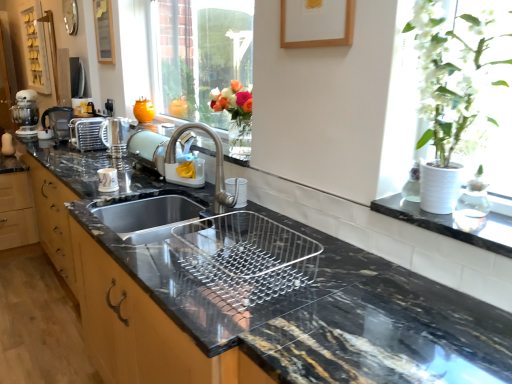
Measure the distance between point (455, 63) and camera.

Point (455, 63) and camera are 1.10 meters apart from each other.

The height and width of the screenshot is (384, 512). Identify the location of wooden picture frame at upper left, placed as the 2th picture frame when sorted from right to left. (104, 31).

This screenshot has width=512, height=384. What do you see at coordinates (115, 301) in the screenshot?
I see `metallic oak cabinet at left` at bounding box center [115, 301].

The width and height of the screenshot is (512, 384). Find the location of `white matte vase at upper right`. white matte vase at upper right is located at coordinates (451, 74).

Is wooden picture frame at upper left, the first picture frame in the left-to-right sequence, smaller than black marble sink at center?

Correct, wooden picture frame at upper left, the first picture frame in the left-to-right sequence, occupies less space than black marble sink at center.

Considering the sizes of wooden picture frame at upper left, which ranks as the first picture frame in top-to-bottom order, and black marble sink at center in the image, is wooden picture frame at upper left, which ranks as the first picture frame in top-to-bottom order, wider or thinner than black marble sink at center?

In the image, wooden picture frame at upper left, which ranks as the first picture frame in top-to-bottom order, appears to be more narrow than black marble sink at center.

Does wooden picture frame at upper left, which ranks as the first picture frame in top-to-bottom order, turn towards black marble sink at center?

No, wooden picture frame at upper left, which ranks as the first picture frame in top-to-bottom order, is not oriented towards black marble sink at center.

Is white matte vase at upper right far away from metallic silver toaster at upper left, which is counted as the second appliance, starting from the right?

Yes, white matte vase at upper right and metallic silver toaster at upper left, which is counted as the second appliance, starting from the right, are quite far apart.

Looking at the image, does white matte vase at upper right seem bigger or smaller compared to metallic silver toaster at upper left, which is counted as the second appliance, starting from the right?

white matte vase at upper right is bigger than metallic silver toaster at upper left, which is counted as the second appliance, starting from the right.

Considering the sizes of white matte vase at upper right and metallic silver toaster at upper left, which is the second appliance from front to back, in the image, is white matte vase at upper right taller or shorter than metallic silver toaster at upper left, which is the second appliance from front to back,?

white matte vase at upper right is taller than metallic silver toaster at upper left, which is the second appliance from front to back.

Where is `appliance that is the 2nd one below the white matte vase at upper right (from a real-world perspective)`? The width and height of the screenshot is (512, 384). appliance that is the 2nd one below the white matte vase at upper right (from a real-world perspective) is located at coordinates (86, 134).

In the image, there is a metallic silver toaster at upper left, marked as the first appliance in a back-to-front arrangement. Where is `window above it (from the image's perspective)`? The height and width of the screenshot is (384, 512). window above it (from the image's perspective) is located at coordinates (200, 54).

Is clear glass window at center positioned with its back to metallic silver toaster at upper left, which is the second appliance from front to back?

No, clear glass window at center is not facing the opposite direction of metallic silver toaster at upper left, which is the second appliance from front to back.

From the image's perspective, is clear glass window at center on top of metallic silver toaster at upper left, which is counted as the second appliance, starting from the right?

Correct, clear glass window at center appears higher than metallic silver toaster at upper left, which is counted as the second appliance, starting from the right, in the image.

Based on the photo, which of these two, clear glass window at center or metallic silver toaster at upper left, which is counted as the second appliance, starting from the right, stands taller?

With more height is clear glass window at center.

Is the position of wooden picture frame at upper center, placed as the 1th picture frame when sorted from front to back, more distant than that of satin nickel faucet at center?

No, wooden picture frame at upper center, placed as the 1th picture frame when sorted from front to back, is closer to the viewer.

Is wooden picture frame at upper center, the 1th picture frame when ordered from bottom to top, oriented away from satin nickel faucet at center?

No, wooden picture frame at upper center, the 1th picture frame when ordered from bottom to top, is not facing the opposite direction of satin nickel faucet at center.

Considering the positions of objects wooden picture frame at upper center, the second picture frame positioned from the top, and satin nickel faucet at center in the image provided, who is more to the right, wooden picture frame at upper center, the second picture frame positioned from the top, or satin nickel faucet at center?

From the viewer's perspective, wooden picture frame at upper center, the second picture frame positioned from the top, appears more on the right side.

Does wooden picture frame at upper center, the second picture frame from the left, have a greater width compared to metallic silver toaster at upper left, which is the second appliance from front to back?

No.

Is wooden picture frame at upper center, the first picture frame viewed from the right, shorter than metallic silver toaster at upper left, arranged as the 1th appliance when viewed from the left?

In fact, wooden picture frame at upper center, the first picture frame viewed from the right, may be taller than metallic silver toaster at upper left, arranged as the 1th appliance when viewed from the left.

Considering the relative positions of wooden picture frame at upper center, which appears as the second picture frame when viewed from the back, and metallic silver toaster at upper left, arranged as the 1th appliance when viewed from the left, in the image provided, is wooden picture frame at upper center, which appears as the second picture frame when viewed from the back, to the left of metallic silver toaster at upper left, arranged as the 1th appliance when viewed from the left, from the viewer's perspective?

No, wooden picture frame at upper center, which appears as the second picture frame when viewed from the back, is not to the left of metallic silver toaster at upper left, arranged as the 1th appliance when viewed from the left.

From the image's perspective, is wooden picture frame at upper center, the second picture frame from the left, positioned above or below metallic silver toaster at upper left, which is the second appliance from front to back?

wooden picture frame at upper center, the second picture frame from the left, is above metallic silver toaster at upper left, which is the second appliance from front to back.

How many degrees apart are the facing directions of satin nickel kettle at center, the 1th appliance positioned from the right, and orange matte vase at upper center?

6.25 degrees separate the facing orientations of satin nickel kettle at center, the 1th appliance positioned from the right, and orange matte vase at upper center.

Image resolution: width=512 pixels, height=384 pixels. What are the coordinates of `vase on the right of satin nickel kettle at center, the second appliance in the back-to-front sequence` in the screenshot? It's located at (143, 110).

Looking at this image, considering the sizes of objects satin nickel kettle at center, the 1th appliance positioned from the right, and orange matte vase at upper center in the image provided, who is wider, satin nickel kettle at center, the 1th appliance positioned from the right, or orange matte vase at upper center?

satin nickel kettle at center, the 1th appliance positioned from the right, is wider.

From the image's perspective, which one is positioned lower, metallic silver coffee machine at left or wooden picture frame at upper left, arranged as the first picture frame when viewed from the back?

metallic silver coffee machine at left is shown below in the image.

Would you say wooden picture frame at upper left, arranged as the first picture frame when viewed from the back, is part of metallic silver coffee machine at left's contents?

Actually, wooden picture frame at upper left, arranged as the first picture frame when viewed from the back, is outside metallic silver coffee machine at left.

In the scene shown: Is metallic silver coffee machine at left directly adjacent to wooden picture frame at upper left, placed as the 2th picture frame when sorted from right to left?

No, metallic silver coffee machine at left is not with wooden picture frame at upper left, placed as the 2th picture frame when sorted from right to left.

Between metallic silver coffee machine at left and wooden picture frame at upper left, positioned as the second picture frame in bottom-to-top order, which one has less height?

Standing shorter between the two is metallic silver coffee machine at left.

The width and height of the screenshot is (512, 384). Find the location of `picture frame that is the 2nd one when counting backward from the black marble sink at center`. picture frame that is the 2nd one when counting backward from the black marble sink at center is located at coordinates (104, 31).

Where is `floral arrangement below the metallic silver toaster at upper left, which is the second appliance from front to back (from the image's perspective)`? This screenshot has width=512, height=384. floral arrangement below the metallic silver toaster at upper left, which is the second appliance from front to back (from the image's perspective) is located at coordinates (451, 74).

Based on their spatial positions, is metallic silver coffee machine at left or white matte vase at upper right further from wooden picture frame at upper center, placed as the 1th picture frame when sorted from front to back?

Based on the image, metallic silver coffee machine at left appears to be further to wooden picture frame at upper center, placed as the 1th picture frame when sorted from front to back.

Looking at the image, which one is located further to wooden picture frame at upper left, placed as the 2th picture frame when sorted from right to left, wooden picture frame at upper center, the second picture frame from the left, or orange matte vase at upper center?

wooden picture frame at upper center, the second picture frame from the left.

Looking at the image, which one is located closer to metallic silver coffee machine at left, black marble sink at center or wooden picture frame at upper center, the second picture frame from the left?

black marble sink at center.

Based on their spatial positions, is clear glass window at center or wooden picture frame at upper center, the second picture frame positioned from the top, closer to metallic silver toaster at upper left, which is counted as the second appliance, starting from the right?

clear glass window at center.

In the scene shown: Considering their positions, is satin nickel kettle at center, the second appliance in the back-to-front sequence, positioned further to metallic oak cabinet at left than metallic silver toaster at upper left, arranged as the 1th appliance when viewed from the left?

The object further to metallic oak cabinet at left is metallic silver toaster at upper left, arranged as the 1th appliance when viewed from the left.

Based on their spatial positions, is orange matte vase at upper center or satin nickel faucet at center closer to satin nickel kettle at center, the second appliance in the back-to-front sequence?

Based on the image, orange matte vase at upper center appears to be nearer to satin nickel kettle at center, the second appliance in the back-to-front sequence.

Based on their spatial positions, is orange matte vase at upper center or metallic silver coffee machine at left further from wooden picture frame at upper left, positioned as the second picture frame in bottom-to-top order?

metallic silver coffee machine at left lies further to wooden picture frame at upper left, positioned as the second picture frame in bottom-to-top order, than the other object.

Considering their positions, is satin nickel kettle at center, the second appliance in the back-to-front sequence, positioned closer to clear glass window at center than black marble sink at center?

satin nickel kettle at center, the second appliance in the back-to-front sequence, lies closer to clear glass window at center than the other object.

Image resolution: width=512 pixels, height=384 pixels. Find the location of `cabinetry positioned between satin nickel faucet at center and satin nickel kettle at center, the 1th appliance positioned from the right, from near to far`. cabinetry positioned between satin nickel faucet at center and satin nickel kettle at center, the 1th appliance positioned from the right, from near to far is located at coordinates (115, 301).

Where is `cabinetry between black marble sink at center and metallic silver coffee machine at left in the front-back direction`? cabinetry between black marble sink at center and metallic silver coffee machine at left in the front-back direction is located at coordinates (115, 301).

Where is `vase between wooden picture frame at upper left, the first picture frame in the left-to-right sequence, and metallic oak cabinet at left from top to bottom`? This screenshot has width=512, height=384. vase between wooden picture frame at upper left, the first picture frame in the left-to-right sequence, and metallic oak cabinet at left from top to bottom is located at coordinates (143, 110).

Where is `picture frame between satin nickel faucet at center and metallic silver coffee machine at left in the front-back direction`? The width and height of the screenshot is (512, 384). picture frame between satin nickel faucet at center and metallic silver coffee machine at left in the front-back direction is located at coordinates (104, 31).